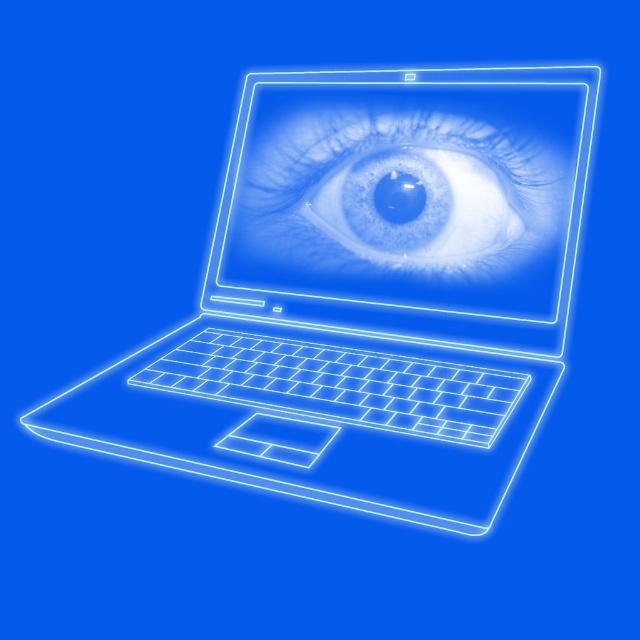
You are looking at the laptop screen showing the eye. There are two points marked on the screen at coordinates point (248, 173) and point (364, 230). Which point is closer to you?

Point (248, 173) is further to the viewer than point (364, 230), so the point closer to you is point (364, 230).

You are designing a digital poster and need to place both the neon white laptop at center and the translucent blue eye at center side by side without overlapping. Which object should you place on the left to ensure they fit within the poster width?

Since the neon white laptop at center might be wider than the translucent blue eye at center, you should place the narrower translucent blue eye at center on the left and the wider neon white laptop at center on the right to ensure they fit side by side without overlapping.

You are an AI assistant analyzing the image. The scene shows a neon white laptop at center and a translucent blue eye at center. Which object is closer to the viewer?

The neon white laptop at center is closer to the viewer than the translucent blue eye at center because it is positioned in front of it.